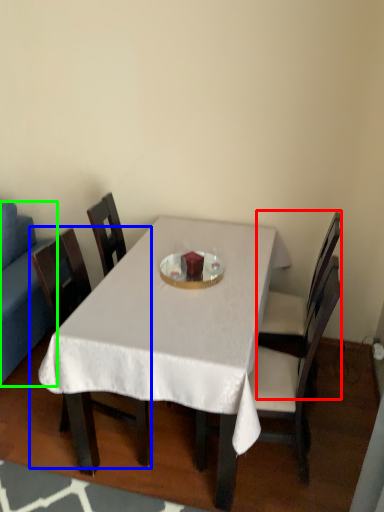
Question: Estimate the real-world distances between objects in this image. Which object is closer to chair (highlighted by a red box), chair (highlighted by a blue box) or studio couch (highlighted by a green box)?

Choices:
 (A) chair
 (B) studio couch

Answer: (A)